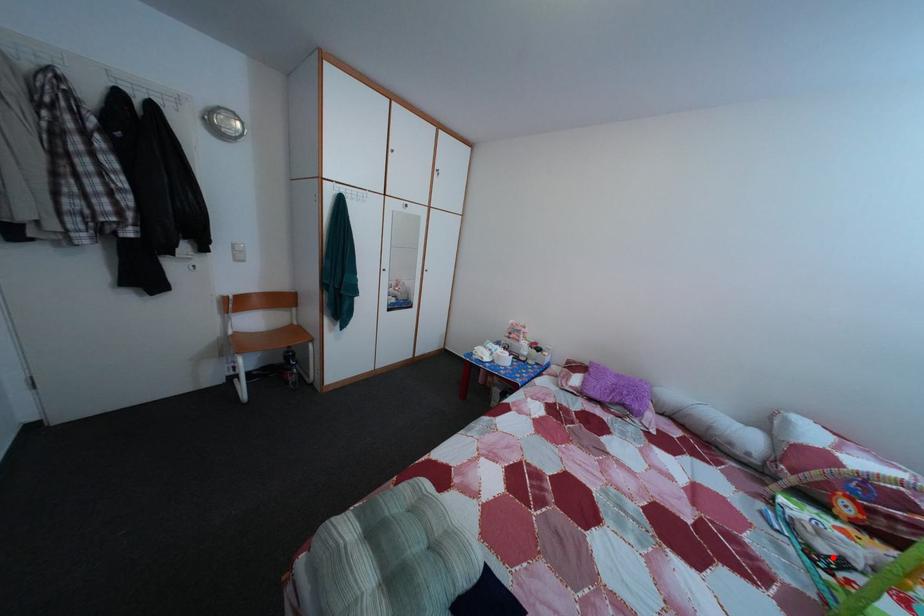
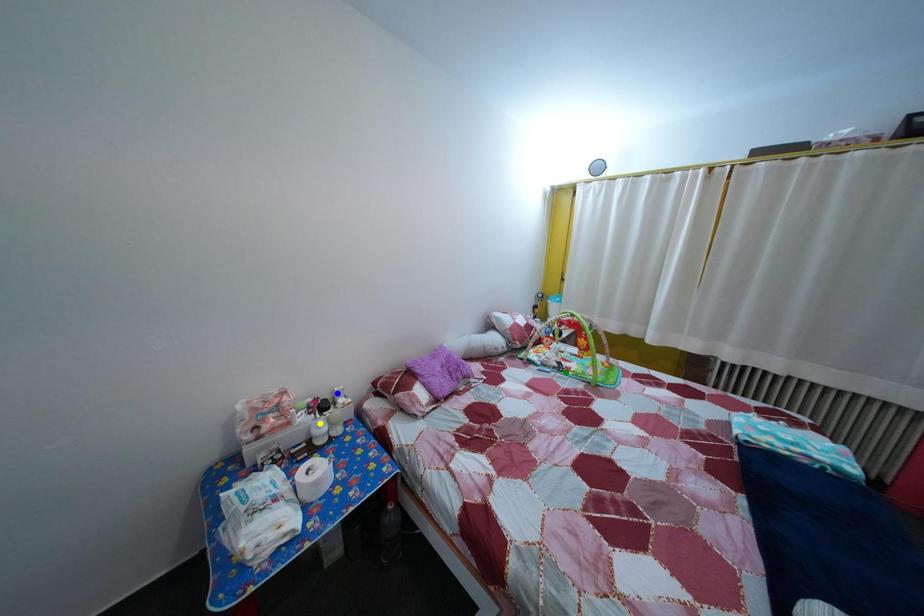
Question: I am providing you with two images of the same scene from different viewpoints. A red point is marked on the first image. You are given multiple points on the second image. Which point in image 2 represents the same 3d spot as the red point in image 1?

Choices:
 (A) blue point
 (B) yellow point
 (C) green point

Answer: (C)